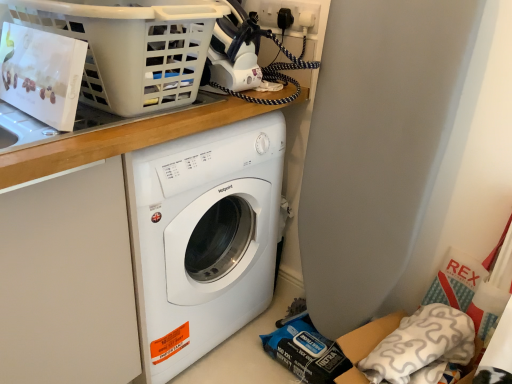
Question: Can you confirm if white plastic basket at upper left is smaller than wooden at upper center?

Choices:
 (A) yes
 (B) no

Answer: (A)

Question: Considering the relative positions of white plastic basket at upper left and wooden at upper center in the image provided, is white plastic basket at upper left to the left of wooden at upper center from the viewer's perspective?

Choices:
 (A) no
 (B) yes

Answer: (B)

Question: Does white plastic basket at upper left lie behind wooden at upper center?

Choices:
 (A) yes
 (B) no

Answer: (B)

Question: Is white plastic basket at upper left positioned far away from wooden at upper center?

Choices:
 (A) yes
 (B) no

Answer: (B)

Question: Is white plastic basket at upper left with wooden at upper center?

Choices:
 (A) yes
 (B) no

Answer: (B)

Question: From the image's perspective, does white plastic basket at upper left appear lower than wooden at upper center?

Choices:
 (A) no
 (B) yes

Answer: (A)

Question: From a real-world perspective, does white soft pillow at lower right stand above white plastic basket at upper left?

Choices:
 (A) yes
 (B) no

Answer: (B)

Question: From the image's perspective, is white soft pillow at lower right located above white plastic basket at upper left?

Choices:
 (A) no
 (B) yes

Answer: (A)

Question: Can you confirm if white soft pillow at lower right is shorter than white plastic basket at upper left?

Choices:
 (A) no
 (B) yes

Answer: (A)

Question: Considering the relative sizes of white soft pillow at lower right and white plastic basket at upper left in the image provided, is white soft pillow at lower right wider than white plastic basket at upper left?

Choices:
 (A) no
 (B) yes

Answer: (A)

Question: Does white soft pillow at lower right have a smaller size compared to white plastic basket at upper left?

Choices:
 (A) no
 (B) yes

Answer: (B)

Question: Is white soft pillow at lower right facing towards white plastic basket at upper left?

Choices:
 (A) no
 (B) yes

Answer: (A)

Question: Considering the relative sizes of white soft pillow at lower right and wooden at upper center in the image provided, is white soft pillow at lower right thinner than wooden at upper center?

Choices:
 (A) yes
 (B) no

Answer: (A)